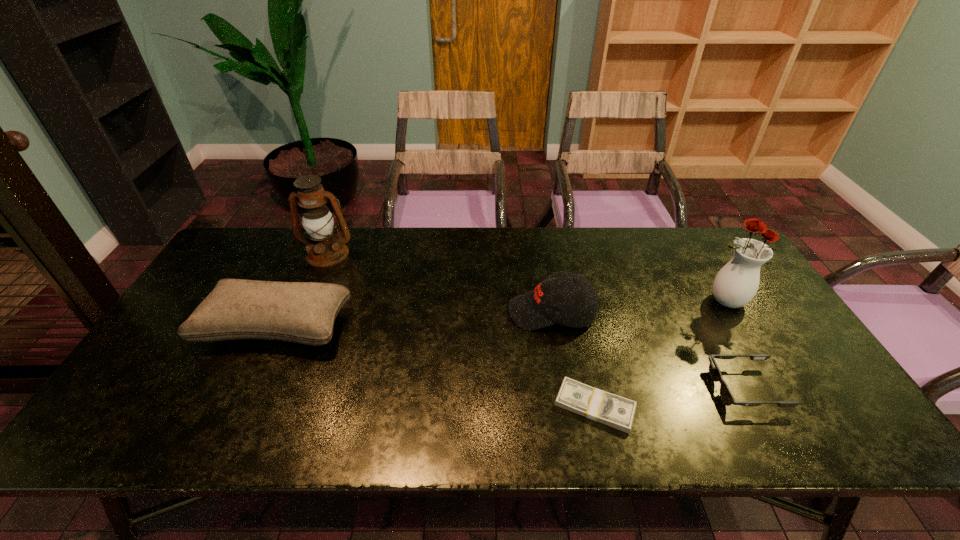
At what (x,y) coordinates should I click in order to perform the action: click on vacant region located on the front-facing side of the baseball cap. Please return your answer as a coordinate pair (x, y). The image size is (960, 540). Looking at the image, I should click on (431, 313).

Where is `vacant space situated on the back of the cushion`? The image size is (960, 540). vacant space situated on the back of the cushion is located at coordinates (321, 233).

Where is `free region located on the temples of the fifth tallest object`? Image resolution: width=960 pixels, height=540 pixels. free region located on the temples of the fifth tallest object is located at coordinates (660, 388).

Find the location of a particular element. This screenshot has height=540, width=960. vacant space located on the temples of the fifth tallest object is located at coordinates (635, 388).

Where is `vacant space located on the temples of the fifth tallest object`? vacant space located on the temples of the fifth tallest object is located at coordinates (610, 388).

Identify the location of vacant area situated 0.340m on the back of the shortest object. (568, 287).

Where is `object situated at the far edge`? Image resolution: width=960 pixels, height=540 pixels. object situated at the far edge is located at coordinates (325, 248).

At what (x,y) coordinates should I click in order to perform the action: click on sunglasses at the near edge. Please return your answer as a coordinate pair (x, y). The image size is (960, 540). Looking at the image, I should click on (725, 393).

Identify the location of dollar that is at the near edge. This screenshot has height=540, width=960. (618, 412).

Find the location of a particular element. The image size is (960, 540). object that is at the left edge is located at coordinates (302, 312).